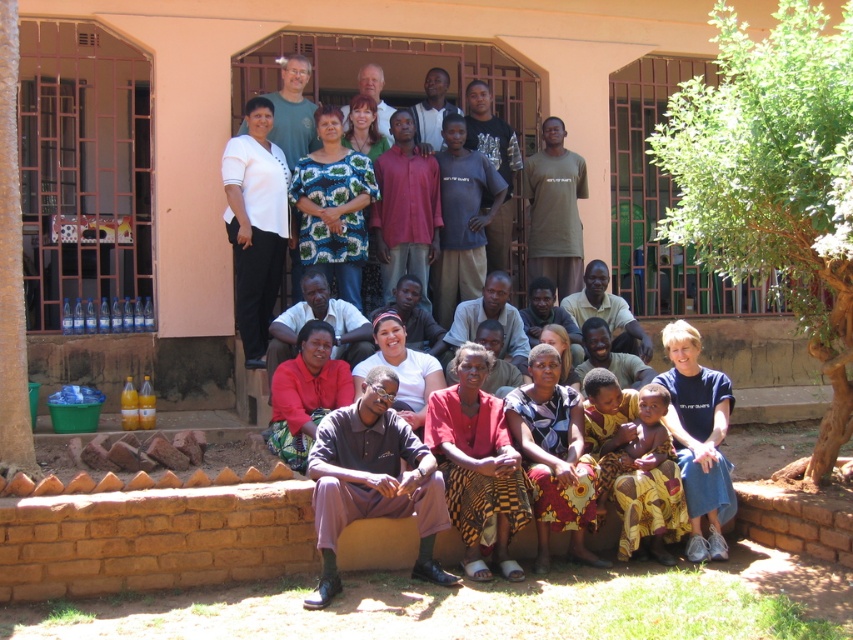
Image resolution: width=853 pixels, height=640 pixels. What do you see at coordinates (653, 202) in the screenshot?
I see `matte green dress at center` at bounding box center [653, 202].

Can you confirm if matte green dress at center is bigger than dark brown fabric pants at lower center?

Correct, matte green dress at center is larger in size than dark brown fabric pants at lower center.

Is point (612, 76) positioned after point (325, 516)?

That is True.

Identify the location of matte green dress at center. The height and width of the screenshot is (640, 853). click(x=653, y=202).